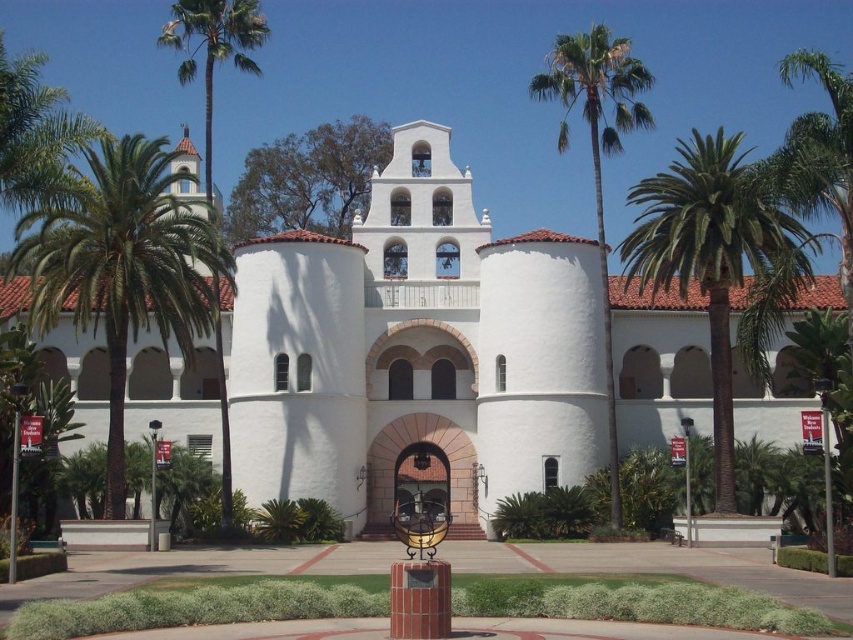
Is green leafy palm tree at left thinner than green leafy palm tree at right?

Correct, green leafy palm tree at left's width is less than green leafy palm tree at right's.

Can you confirm if green leafy palm tree at left is positioned below green leafy palm tree at right?

Yes.

Which is in front, point (115, 173) or point (714, 257)?

Positioned in front is point (115, 173).

Where is `green leafy palm tree at left`? This screenshot has width=853, height=640. green leafy palm tree at left is located at coordinates (123, 266).

Locate an element on the screen. The height and width of the screenshot is (640, 853). green leafy palm tree at left is located at coordinates (123, 266).

Is point (19, 259) more distant than point (610, 456)?

No, it is in front of (610, 456).

Is point (114, 493) positioned before point (566, 100)?

Yes, it is in front of point (566, 100).

This screenshot has width=853, height=640. Identify the location of green leafy palm tree at left. (123, 266).

Can you confirm if green leafy palm tree at right is smaller than green leafy palm tree at upper right?

Actually, green leafy palm tree at right might be larger than green leafy palm tree at upper right.

What are the coordinates of `green leafy palm tree at right` in the screenshot? It's located at (711, 253).